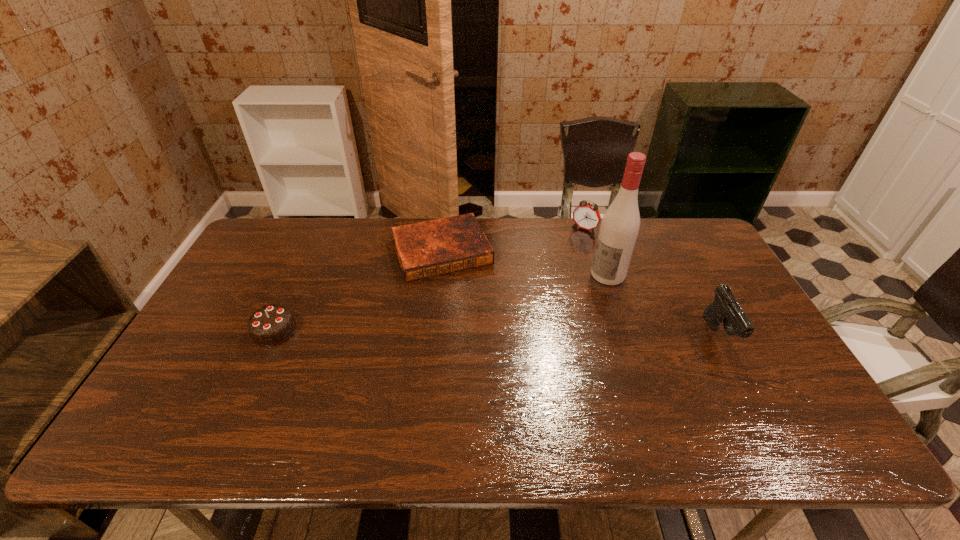
Locate an element on the screen. object that is at the left edge is located at coordinates (271, 325).

The image size is (960, 540). Find the location of `object that is at the right edge`. object that is at the right edge is located at coordinates (725, 308).

Identify the location of vacant region at the far edge. (520, 238).

This screenshot has height=540, width=960. I want to click on free space at the near edge of the desktop, so click(710, 390).

At what (x,y) coordinates should I click in order to perform the action: click on free space at the right edge. Please return your answer as a coordinate pair (x, y). The image size is (960, 540). Looking at the image, I should click on (732, 341).

Locate an element on the screen. This screenshot has height=540, width=960. free location at the far right corner is located at coordinates (689, 228).

Where is `vacant space at the near right corner of the desktop`? The image size is (960, 540). vacant space at the near right corner of the desktop is located at coordinates (795, 390).

Identify the location of free spot between the rightmost object and the alarm clock. This screenshot has height=540, width=960. (652, 282).

The image size is (960, 540). I want to click on free space between the Bible and the fourth tallest object, so click(x=358, y=291).

Locate an element on the screen. This screenshot has width=960, height=540. free space between the leftmost object and the rightmost object is located at coordinates (496, 333).